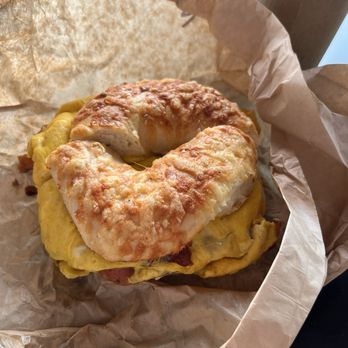
The width and height of the screenshot is (348, 348). Identify the location of napkin. (340, 267).